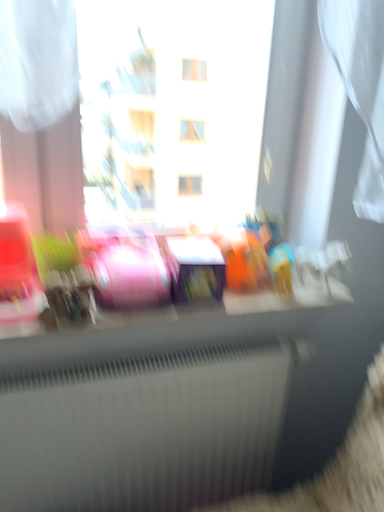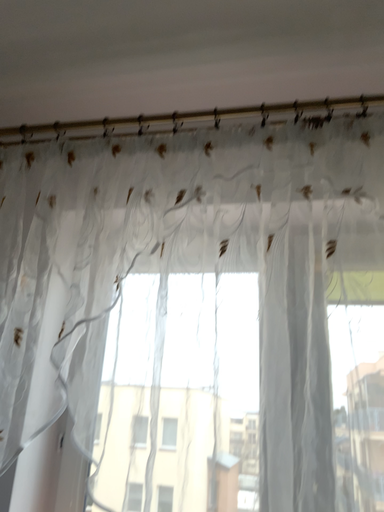
Question: How did the camera likely rotate when shooting the video?

Choices:
 (A) rotated left
 (B) rotated right

Answer: (A)